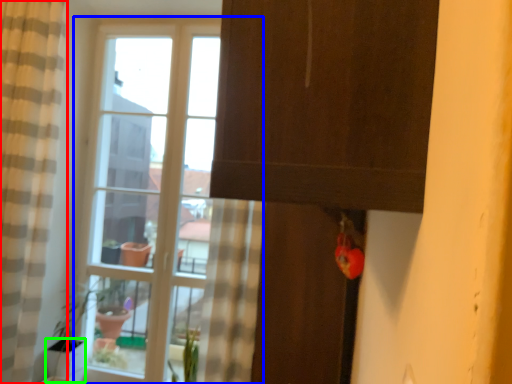
Question: Which object is the closest to the curtain (highlighted by a red box)? Choose among these: window (highlighted by a blue box) or glass vase (highlighted by a green box).

Choices:
 (A) window
 (B) glass vase

Answer: (B)